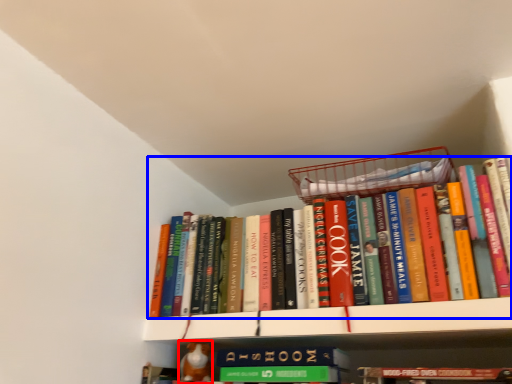
Question: Which object is closer to the camera taking this photo, toy (highlighted by a red box) or book (highlighted by a blue box)?

Choices:
 (A) toy
 (B) book

Answer: (B)